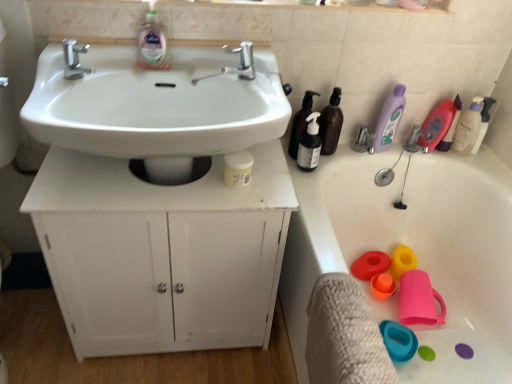
Find the location of a particular element. vacant space situated above white matte cabinet at center (from a real-world perspective) is located at coordinates (172, 170).